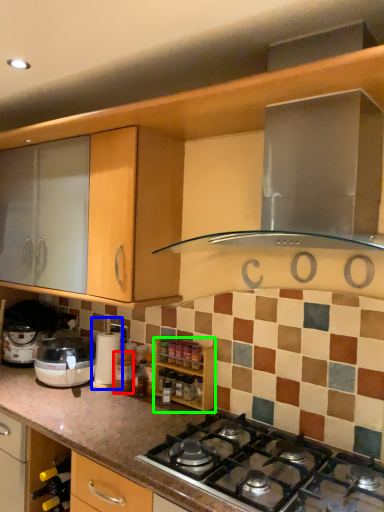
Question: Which object is positioned closest to bottle (highlighted by a red box)? Select from coffee machine (highlighted by a blue box) and cabinetry (highlighted by a green box).

Choices:
 (A) coffee machine
 (B) cabinetry

Answer: (A)